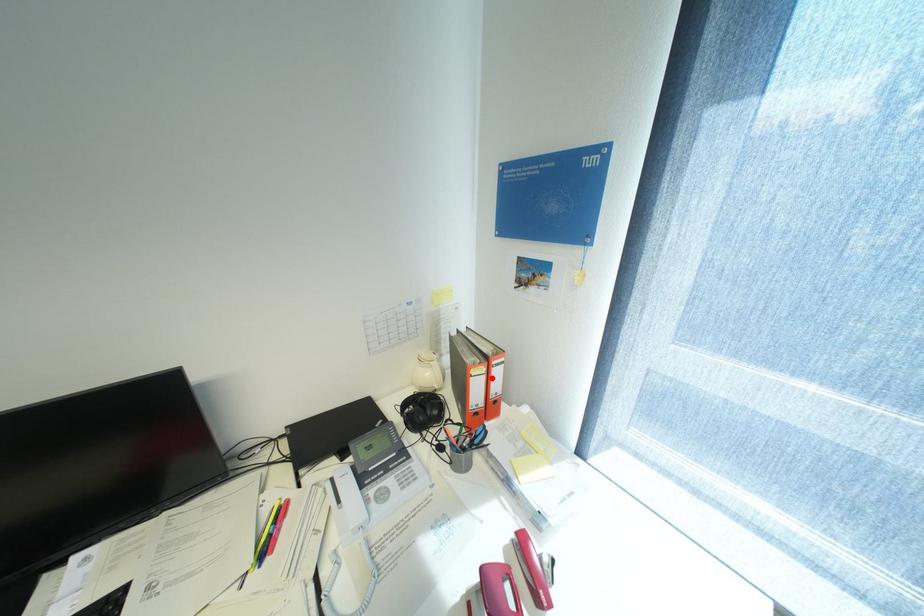
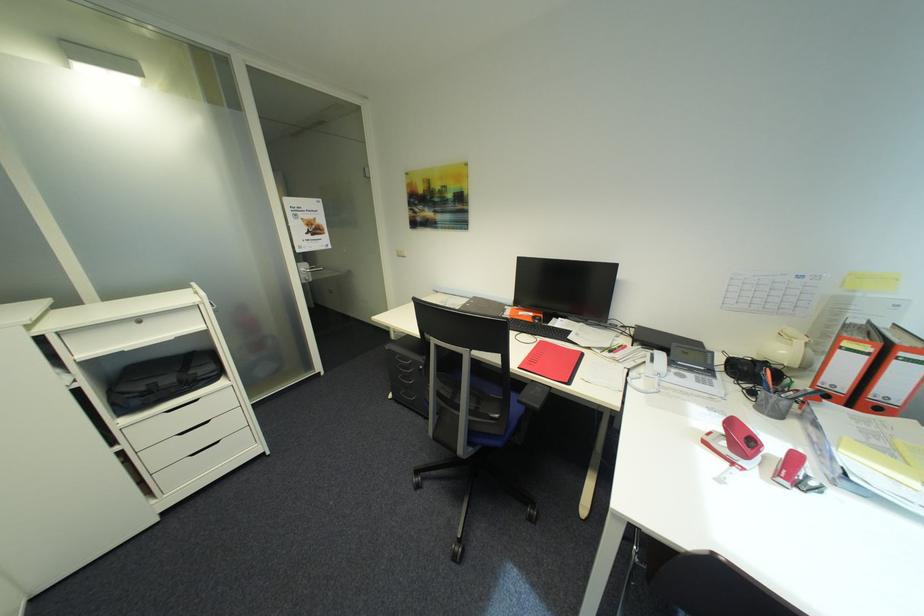
Find the pixel in the second image that matches the highlighted location in the first image.

(872, 359)